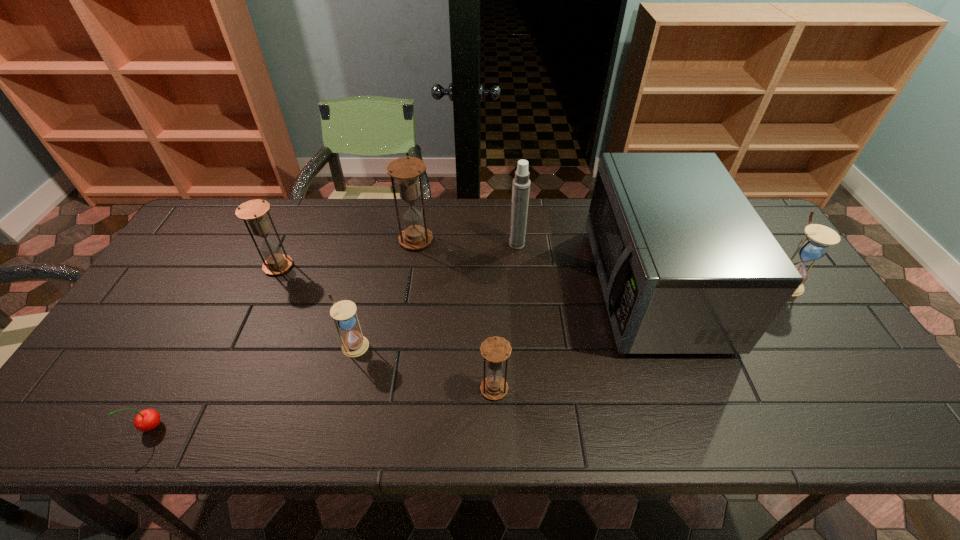
Find the location of a particular element. This screenshot has width=960, height=540. object that is at the right edge is located at coordinates (814, 246).

Where is `vacant space at the far edge`? vacant space at the far edge is located at coordinates (538, 202).

In the image, there is a desktop. Find the location of `free space at the near edge`. free space at the near edge is located at coordinates (296, 420).

The width and height of the screenshot is (960, 540). I want to click on vacant region at the left edge of the desktop, so click(x=216, y=256).

The image size is (960, 540). What are the coordinates of `free space at the far left corner` in the screenshot? It's located at (202, 232).

Where is `vacant space at the near right corner`? vacant space at the near right corner is located at coordinates (888, 429).

Locate an element on the screen. vacant area that lies between the second hourglass from right to left and the second smallest brown hourglass is located at coordinates (386, 327).

Where is `unoccupied area between the farthest brown hourglass and the leftmost brown hourglass`? This screenshot has height=540, width=960. unoccupied area between the farthest brown hourglass and the leftmost brown hourglass is located at coordinates (348, 253).

Where is `vacant area between the seventh object from right to left and the rightmost brown hourglass`? This screenshot has width=960, height=540. vacant area between the seventh object from right to left and the rightmost brown hourglass is located at coordinates (386, 327).

Locate an element on the screen. The width and height of the screenshot is (960, 540). vacant point located between the shortest object and the farther white hourglass is located at coordinates (468, 354).